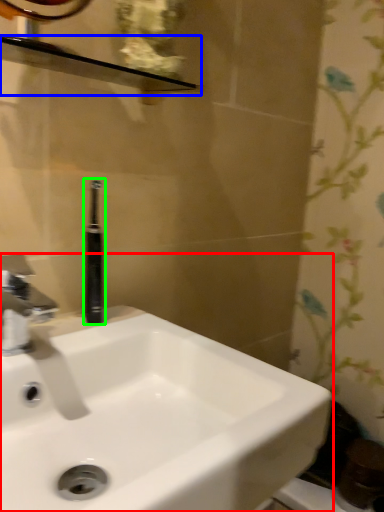
Question: Which is farther away from sink (highlighted by a red box)? balustrade (highlighted by a blue box) or toiletry (highlighted by a green box)?

Choices:
 (A) balustrade
 (B) toiletry

Answer: (A)